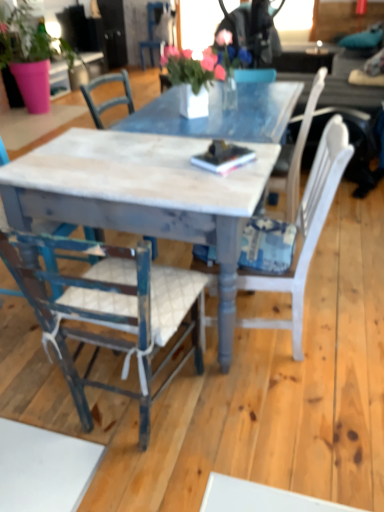
Where is `white marble table at center`? The width and height of the screenshot is (384, 512). white marble table at center is located at coordinates (x=143, y=195).

What do you see at coordinates (143, 195) in the screenshot? The width and height of the screenshot is (384, 512). I see `white marble table at center` at bounding box center [143, 195].

At what (x,y) coordinates should I click in order to perform the action: click on white painted wood chair at left, placed as the third chair when sorted from bottom to top. Please return your answer as a coordinate pair (x, y). The width and height of the screenshot is (384, 512). Looking at the image, I should click on (55, 242).

The image size is (384, 512). What do you see at coordinates (55, 242) in the screenshot?
I see `white painted wood chair at left, placed as the third chair when sorted from bottom to top` at bounding box center [55, 242].

What do you see at coordinates (305, 231) in the screenshot?
I see `white painted wood chair at center, the 3th chair in the top-to-bottom sequence` at bounding box center [305, 231].

Measure the distance between white painted wood chair at center, the 3th chair in the top-to-bottom sequence, and camera.

The depth of white painted wood chair at center, the 3th chair in the top-to-bottom sequence, is 4.54 feet.

Image resolution: width=384 pixels, height=512 pixels. Find the location of `white marble table at center`. white marble table at center is located at coordinates (143, 195).

From a real-world perspective, who is located lower, distressed wood chair at center, the first chair in the bottom-to-top sequence, or pink fabric floral arrangement at center?

distressed wood chair at center, the first chair in the bottom-to-top sequence.

Looking at this image, based on their positions, is distressed wood chair at center, marked as the 4th chair in a back-to-front arrangement, located to the left or right of pink fabric floral arrangement at center?

In the image, distressed wood chair at center, marked as the 4th chair in a back-to-front arrangement, appears on the left side of pink fabric floral arrangement at center.

Considering the relative positions of distressed wood chair at center, marked as the 4th chair in a back-to-front arrangement, and pink fabric floral arrangement at center in the image provided, is distressed wood chair at center, marked as the 4th chair in a back-to-front arrangement, behind pink fabric floral arrangement at center?

No, it is in front of pink fabric floral arrangement at center.

Which object is thinner, distressed wood chair at center, the first chair in the bottom-to-top sequence, or pink fabric floral arrangement at center?

distressed wood chair at center, the first chair in the bottom-to-top sequence, is thinner.

Based on the photo, is the position of pink fabric plant at left more distant than that of distressed wood chair at center, which appears as the 1th chair when viewed from the front?

Yes, pink fabric plant at left is further from the viewer.

Between pink fabric plant at left and distressed wood chair at center, the first chair in the bottom-to-top sequence, which one has smaller width?

distressed wood chair at center, the first chair in the bottom-to-top sequence, is thinner.

Is pink fabric plant at left not near distressed wood chair at center, the first chair in the bottom-to-top sequence?

pink fabric plant at left is far away from distressed wood chair at center, the first chair in the bottom-to-top sequence.

From the image's perspective, is blue painted wood chair at upper center, marked as the first chair in a back-to-front arrangement, above or below pink fabric plant at left?

blue painted wood chair at upper center, marked as the first chair in a back-to-front arrangement, is situated higher than pink fabric plant at left in the image.

Based on the photo, is blue painted wood chair at upper center, the fourth chair when ordered from bottom to top, placed right next to pink fabric plant at left?

There is a gap between blue painted wood chair at upper center, the fourth chair when ordered from bottom to top, and pink fabric plant at left.

Considering the relative sizes of blue painted wood chair at upper center, positioned as the first chair in top-to-bottom order, and pink fabric plant at left in the image provided, is blue painted wood chair at upper center, positioned as the first chair in top-to-bottom order, smaller than pink fabric plant at left?

Indeed, blue painted wood chair at upper center, positioned as the first chair in top-to-bottom order, has a smaller size compared to pink fabric plant at left.

Considering the sizes of objects white painted wood chair at center, the 3th chair in the top-to-bottom sequence, and pink fabric floral arrangement at center in the image provided, who is thinner, white painted wood chair at center, the 3th chair in the top-to-bottom sequence, or pink fabric floral arrangement at center?

white painted wood chair at center, the 3th chair in the top-to-bottom sequence.

Is white painted wood chair at center, the 3th chair viewed from the back, spatially inside pink fabric floral arrangement at center, or outside of it?

white painted wood chair at center, the 3th chair viewed from the back, is not enclosed by pink fabric floral arrangement at center.

Visually, is white painted wood chair at center, the 3th chair in the top-to-bottom sequence, positioned to the left or to the right of pink fabric floral arrangement at center?

In the image, white painted wood chair at center, the 3th chair in the top-to-bottom sequence, appears on the right side of pink fabric floral arrangement at center.

Is white painted wood chair at center, the 3th chair viewed from the back, taller or shorter than pink fabric floral arrangement at center?

white painted wood chair at center, the 3th chair viewed from the back, is taller than pink fabric floral arrangement at center.

Is white painted wood chair at left, acting as the third chair starting from the front, outside of white painted wood chair at center, the 3th chair viewed from the back?

Yes, white painted wood chair at left, acting as the third chair starting from the front, is located beyond the bounds of white painted wood chair at center, the 3th chair viewed from the back.

Who is shorter, white painted wood chair at left, acting as the third chair starting from the front, or white painted wood chair at center, the second chair ordered from the bottom?

With less height is white painted wood chair at center, the second chair ordered from the bottom.

Locate an element on the screen. The image size is (384, 512). chair that is the 3rd object to the left of the white painted wood chair at center, which appears as the 2th chair when viewed from the front, starting at the anchor is located at coordinates (55, 242).

Is white painted wood chair at left, placed as the third chair when sorted from bottom to top, oriented towards white painted wood chair at center, which appears as the 2th chair when viewed from the front?

Yes, white painted wood chair at left, placed as the third chair when sorted from bottom to top, is facing white painted wood chair at center, which appears as the 2th chair when viewed from the front.

Measure the distance from white marble table at center to blue painted wood chair at upper center, the fourth chair when ordered from bottom to top.

They are 3.30 meters apart.

Considering their positions, is white marble table at center located in front of or behind blue painted wood chair at upper center, acting as the fourth chair starting from the front?

In the image, white marble table at center appears in front of blue painted wood chair at upper center, acting as the fourth chair starting from the front.

From a real-world perspective, who is located lower, white marble table at center or blue painted wood chair at upper center, positioned as the first chair in top-to-bottom order?

From a 3D spatial view, white marble table at center is below.

From the image's perspective, which object appears higher, white marble table at center or blue painted wood chair at upper center, marked as the first chair in a back-to-front arrangement?

blue painted wood chair at upper center, marked as the first chair in a back-to-front arrangement, from the image's perspective.

Looking at this image, is pink fabric plant at left oriented towards pink fabric floral arrangement at center?

Yes, pink fabric plant at left is facing pink fabric floral arrangement at center.

How distant is pink fabric plant at left from pink fabric floral arrangement at center?

pink fabric plant at left and pink fabric floral arrangement at center are 3.56 feet apart.

In order to click on floral arrangement below the pink fabric plant at left (from the image's perspective) in this screenshot , I will do `click(202, 63)`.

Which of these two, pink fabric plant at left or pink fabric floral arrangement at center, stands taller?

pink fabric plant at left is taller.

You are a GUI agent. You are given a task and a screenshot of the screen. Output one action in this format:
    pyautogui.click(x=<x>, y=<y>)
    Task: Click on the floral arrangement lying on the right of distressed wood chair at center, which is counted as the 4th chair, starting from the top
    
    Given the screenshot: What is the action you would take?
    pyautogui.click(x=202, y=63)

At what (x,y) coordinates should I click in order to perform the action: click on the 3rd chair in front of the pink fabric plant at left, starting your count from the anchor. Please return your answer as a coordinate pair (x, y). The image size is (384, 512). Looking at the image, I should click on (112, 313).

Looking at the image, which one is located further to white painted wood chair at center, the 3th chair viewed from the back, pink fabric floral arrangement at center or blue painted wood chair at upper center, acting as the fourth chair starting from the front?

blue painted wood chair at upper center, acting as the fourth chair starting from the front, is further to white painted wood chair at center, the 3th chair viewed from the back.

Considering their positions, is blue painted wood chair at upper center, acting as the fourth chair starting from the front, positioned further to white painted wood chair at left, placed as the third chair when sorted from bottom to top, than white marble table at center?

blue painted wood chair at upper center, acting as the fourth chair starting from the front, lies further to white painted wood chair at left, placed as the third chair when sorted from bottom to top, than the other object.

When comparing their distances from pink fabric plant at left, does white painted wood chair at left, the 2th chair in the back-to-front sequence, or white painted wood chair at center, the 3th chair in the top-to-bottom sequence, seem closer?

Based on the image, white painted wood chair at left, the 2th chair in the back-to-front sequence, appears to be nearer to pink fabric plant at left.

From the image, which object appears to be nearer to blue painted wood chair at upper center, marked as the first chair in a back-to-front arrangement, white painted wood chair at center, the 3th chair viewed from the back, or distressed wood chair at center, marked as the 4th chair in a back-to-front arrangement?

Based on the image, white painted wood chair at center, the 3th chair viewed from the back, appears to be nearer to blue painted wood chair at upper center, marked as the first chair in a back-to-front arrangement.

Estimate the real-world distances between objects in this image. Which object is closer to white painted wood chair at left, placed as the third chair when sorted from bottom to top, pink fabric floral arrangement at center or white marble table at center?

Among the two, white marble table at center is located nearer to white painted wood chair at left, placed as the third chair when sorted from bottom to top.

Looking at the image, which one is located closer to blue painted wood chair at upper center, acting as the fourth chair starting from the front, white marble table at center or pink fabric floral arrangement at center?

Based on the image, pink fabric floral arrangement at center appears to be nearer to blue painted wood chair at upper center, acting as the fourth chair starting from the front.

From the image, which object appears to be farther from white marble table at center, distressed wood chair at center, which appears as the 1th chair when viewed from the front, or blue painted wood chair at upper center, the fourth chair when ordered from bottom to top?

Among the two, blue painted wood chair at upper center, the fourth chair when ordered from bottom to top, is located further to white marble table at center.

Based on their spatial positions, is white painted wood chair at center, the 3th chair in the top-to-bottom sequence, or white marble table at center further from white painted wood chair at left, which appears as the 2th chair when viewed from the top?

Among the two, white painted wood chair at center, the 3th chair in the top-to-bottom sequence, is located further to white painted wood chair at left, which appears as the 2th chair when viewed from the top.

This screenshot has width=384, height=512. What are the coordinates of `chair between white painted wood chair at center, the 3th chair in the top-to-bottom sequence, and pink fabric floral arrangement at center in the front-back direction` in the screenshot? It's located at (55, 242).

Locate an element on the screen. desk between distressed wood chair at center, marked as the 4th chair in a back-to-front arrangement, and blue painted wood chair at upper center, acting as the fourth chair starting from the front, along the z-axis is located at coordinates (143, 195).

In order to click on desk located between white painted wood chair at center, the second chair ordered from the bottom, and pink fabric plant at left in the depth direction in this screenshot , I will do `click(143, 195)`.

What are the coordinates of `houseplant between pink fabric floral arrangement at center and blue painted wood chair at upper center, the fourth chair when ordered from bottom to top, along the z-axis` in the screenshot? It's located at (30, 54).